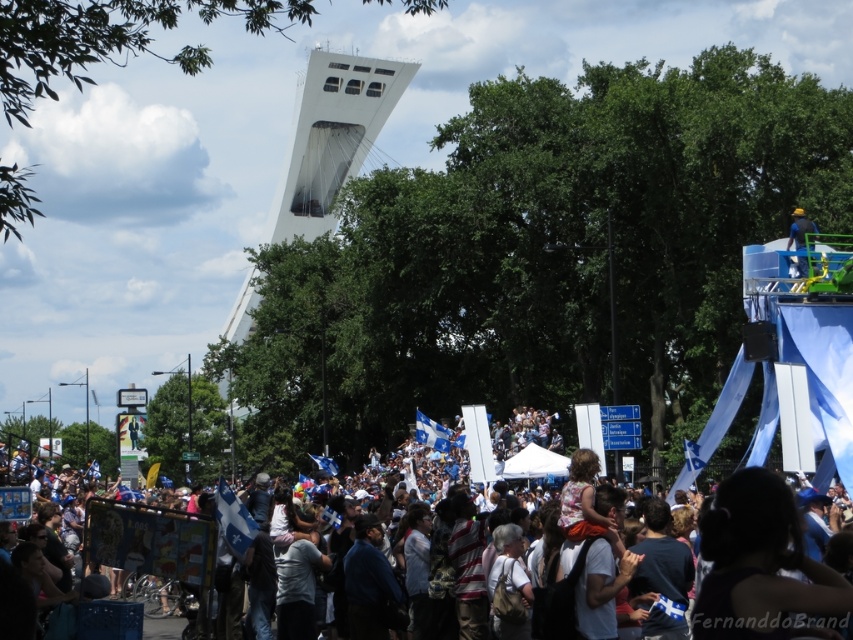
You are a drone operator trying to capture a photo of the yellow matte helmet at upper right while avoiding the white cotton crowd at lower center. Given the distance between them, can you safely fly the drone from the crowd to the helmet without getting too close?

The white cotton crowd at lower center and yellow matte helmet at upper right are 30.62 meters apart from each other. Since the distance is relatively large, the drone can safely fly between them without getting too close to either object.

From the picture: You are a photographer trying to capture a photo of the white smooth tower at center and the yellow matte helmet at upper right. Since you want the tower to appear bigger in the photo than the helmet, which object should you focus on to achieve this effect?

The white smooth tower at center is wider than the yellow matte helmet at upper right, so focusing on the tower will make it appear larger in the photo.

You are a photographer at the event and want to capture a photo that includes both the white smooth tower at center and the yellow matte helmet at upper right. Based on their positions, which object should you position on the left side of your camera frame?

The white smooth tower at center should be positioned on the left side of your camera frame since it is to the left of the yellow matte helmet at upper right.